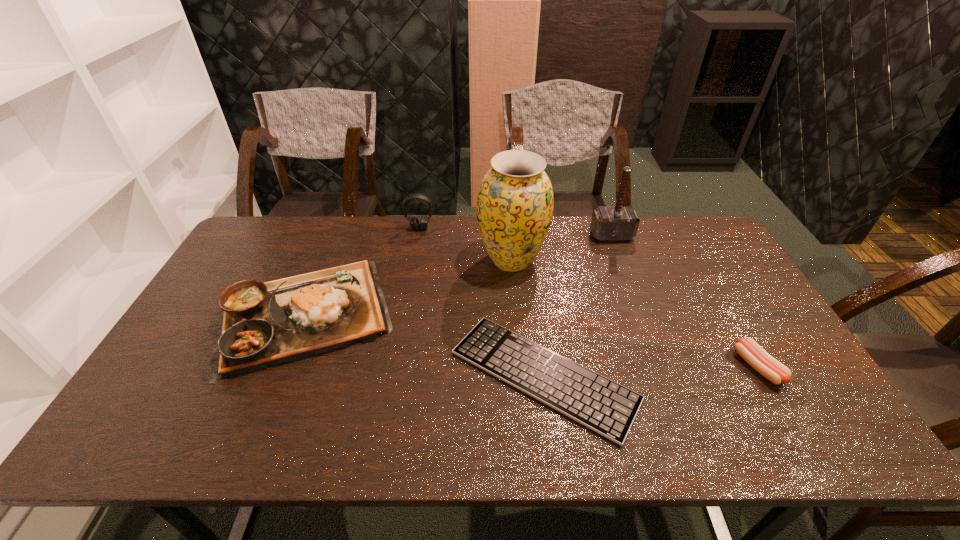
What are the coordinates of `vacant point located 0.250m on the right of the platter` in the screenshot? It's located at (482, 315).

Locate an element on the screen. This screenshot has width=960, height=540. free space located on the left of the sausage is located at coordinates (664, 367).

Find the location of a particular element. The image size is (960, 540). free space located on the back of the shortest object is located at coordinates (526, 239).

Image resolution: width=960 pixels, height=540 pixels. What are the coordinates of `vase at the far edge` in the screenshot? It's located at (515, 202).

Locate an element on the screen. This screenshot has height=540, width=960. hammer present at the far edge is located at coordinates (618, 223).

Identify the location of headset located at the far edge. Image resolution: width=960 pixels, height=540 pixels. (414, 222).

Find the location of a particular element. This screenshot has height=540, width=960. object located in the near edge section of the desktop is located at coordinates (608, 408).

Identify the location of object situated at the left edge. (264, 324).

Identify the location of object that is at the right edge. (748, 349).

The image size is (960, 540). In the image, there is a desktop. What are the coordinates of `vacant space at the far edge` in the screenshot? It's located at (433, 258).